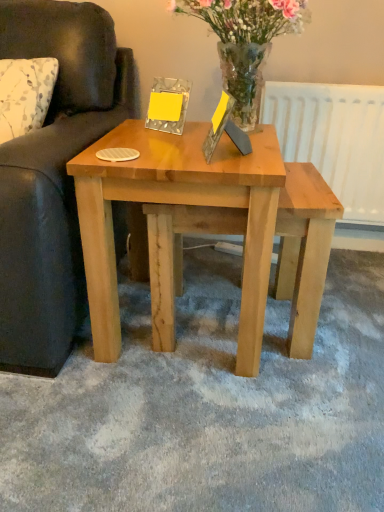
The image size is (384, 512). What do you see at coordinates (53, 176) in the screenshot?
I see `dark brown leather couch at left` at bounding box center [53, 176].

What do you see at coordinates (216, 214) in the screenshot? The image size is (384, 512). I see `natural wood coffee table at center` at bounding box center [216, 214].

Identify the location of natural wood coffee table at center. The width and height of the screenshot is (384, 512). (216, 214).

Where is `wooden picture frame at center`? wooden picture frame at center is located at coordinates (218, 124).

In the image, is white matte radiator at upper right positioned in front of or behind natural wood coffee table at center?

white matte radiator at upper right is positioned farther from the viewer than natural wood coffee table at center.

Consider the image. From a real-world perspective, is white matte radiator at upper right positioned above or below natural wood coffee table at center?

In terms of real-world spatial position, white matte radiator at upper right is above natural wood coffee table at center.

Which is less distant, [211,141] or [271,1]?

The point [211,141] is closer to the camera.

Are wooden picture frame at center and translucent glass vase at upper center located far from each other?

No, wooden picture frame at center is not far away from translucent glass vase at upper center.

Considering the relative positions of translucent glass vase at upper center and dark brown leather couch at left in the image provided, is translucent glass vase at upper center to the right of dark brown leather couch at left from the viewer's perspective?

Yes, translucent glass vase at upper center is to the right of dark brown leather couch at left.

From a real-world perspective, is translucent glass vase at upper center over dark brown leather couch at left?

Yes, from a real-world perspective, translucent glass vase at upper center is over dark brown leather couch at left

Which of these two, translucent glass vase at upper center or dark brown leather couch at left, is smaller?

With smaller size is translucent glass vase at upper center.

Considering the positions of objects wooden picture frame at center and natural wood coffee table at center in the image provided, who is more to the right, wooden picture frame at center or natural wood coffee table at center?

wooden picture frame at center.

From a real-world perspective, is wooden picture frame at center below natural wood coffee table at center?

No, from a real-world perspective, wooden picture frame at center is not beneath natural wood coffee table at center.

Can you confirm if wooden picture frame at center is smaller than natural wood coffee table at center?

Yes.

From the image's perspective, is wooden picture frame at center above or below natural wood coffee table at center?

From the image's perspective, wooden picture frame at center appears above natural wood coffee table at center.

Is point (103, 291) closer or farther from the camera than point (212, 137)?

Point (103, 291) is positioned farther from the camera compared to point (212, 137).

Considering the sizes of objects natural wood coffee table at center and wooden picture frame at center in the image provided, who is shorter, natural wood coffee table at center or wooden picture frame at center?

wooden picture frame at center is shorter.

Considering the relative sizes of natural wood coffee table at center and wooden picture frame at center in the image provided, is natural wood coffee table at center wider than wooden picture frame at center?

Indeed, natural wood coffee table at center has a greater width compared to wooden picture frame at center.

Can you tell me how much white matte radiator at upper right and translucent glass vase at upper center differ in facing direction?

They differ by 3.17 degrees in their facing directions.

Does point (357, 95) appear closer or farther from the camera than point (237, 23)?

Point (357, 95) is positioned farther from the camera compared to point (237, 23).

Would you say white matte radiator at upper right is outside translucent glass vase at upper center?

Indeed, white matte radiator at upper right is completely outside translucent glass vase at upper center.

Based on the photo, which object is further away from the camera taking this photo, translucent glass vase at upper center or wooden picture frame at center?

Positioned behind is translucent glass vase at upper center.

From a real-world perspective, does translucent glass vase at upper center sit lower than wooden picture frame at center?

Incorrect, from a real-world perspective, translucent glass vase at upper center is higher than wooden picture frame at center.

Between translucent glass vase at upper center and wooden picture frame at center, which one appears on the left side from the viewer's perspective?

Positioned to the left is wooden picture frame at center.

Who is smaller, translucent glass vase at upper center or wooden picture frame at center?

Smaller between the two is wooden picture frame at center.

Locate an element on the screen. coffee table that appears in front of the white matte radiator at upper right is located at coordinates (216, 214).

This screenshot has width=384, height=512. Identify the location of floral arrangement on the right of wooden picture frame at center. (246, 42).

Estimate the real-world distances between objects in this image. Which object is closer to white matte radiator at upper right, translucent glass vase at upper center or wooden picture frame at center?

translucent glass vase at upper center is positioned closer to the anchor white matte radiator at upper right.

Considering their positions, is translucent glass vase at upper center positioned further to dark brown leather couch at left than wooden picture frame at center?

wooden picture frame at center is positioned further to the anchor dark brown leather couch at left.

When comparing their distances from translucent glass vase at upper center, does wooden picture frame at center or dark brown leather couch at left seem further?

dark brown leather couch at left lies further to translucent glass vase at upper center than the other object.

Which object lies further to the anchor point white matte radiator at upper right, natural wood coffee table at center or wooden picture frame at center?

Based on the image, wooden picture frame at center appears to be further to white matte radiator at upper right.

When comparing their distances from dark brown leather couch at left, does translucent glass vase at upper center or white matte radiator at upper right seem closer?

The object closer to dark brown leather couch at left is translucent glass vase at upper center.

Estimate the real-world distances between objects in this image. Which object is further from translucent glass vase at upper center, natural wood coffee table at center or wooden picture frame at center?

natural wood coffee table at center.

Which object lies further to the anchor point wooden picture frame at center, natural wood coffee table at center or white matte radiator at upper right?

white matte radiator at upper right lies further to wooden picture frame at center than the other object.

Considering their positions, is translucent glass vase at upper center positioned further to wooden picture frame at center than white matte radiator at upper right?

white matte radiator at upper right is further to wooden picture frame at center.

Locate an element on the screen. This screenshot has height=512, width=384. picture frame situated between dark brown leather couch at left and white matte radiator at upper right from left to right is located at coordinates (218, 124).

Locate an element on the screen. This screenshot has height=512, width=384. floral arrangement located between wooden picture frame at center and white matte radiator at upper right in the depth direction is located at coordinates (246, 42).

Where is `coffee table between dark brown leather couch at left and translucent glass vase at upper center from left to right`? This screenshot has width=384, height=512. coffee table between dark brown leather couch at left and translucent glass vase at upper center from left to right is located at coordinates (216, 214).

Image resolution: width=384 pixels, height=512 pixels. I want to click on coffee table situated between dark brown leather couch at left and white matte radiator at upper right from left to right, so click(216, 214).